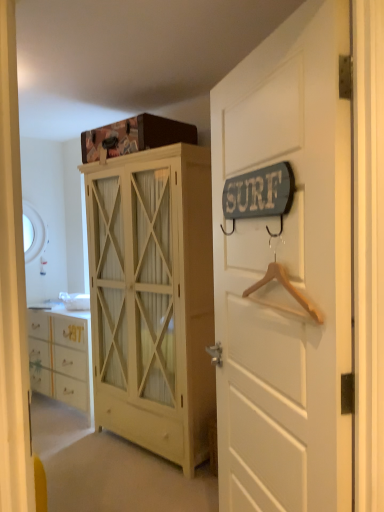
Question: Is point [x=160, y=411] positioned closer to the camera than point [x=266, y=274]?

Choices:
 (A) farther
 (B) closer

Answer: (A)

Question: Visually, is matte yellow cabinet at center positioned to the left or to the right of wooden hanger at right?

Choices:
 (A) right
 (B) left

Answer: (B)

Question: Which of these objects is positioned closest to the white wood door at upper right?

Choices:
 (A) matte yellow cabinet at center
 (B) wooden hanger at right

Answer: (B)

Question: Considering the real-world distances, which object is closest to the white wood door at upper right?

Choices:
 (A) matte yellow cabinet at center
 (B) wooden hanger at right

Answer: (B)